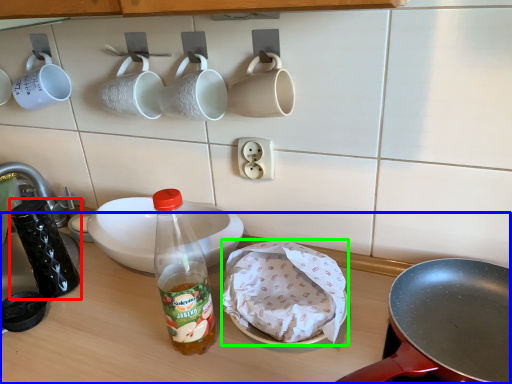
Question: Considering the real-world distances, which object is closest to tableware (highlighted by a red box)? table top (highlighted by a blue box) or food (highlighted by a green box).

Choices:
 (A) table top
 (B) food

Answer: (A)